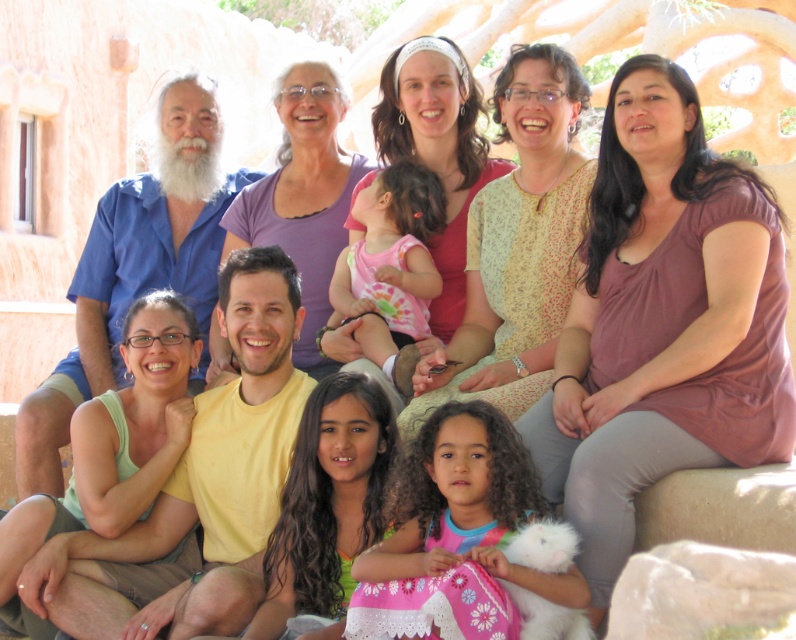
Question: Among these points, which one is nearest to the camera?

Choices:
 (A) (514, 136)
 (B) (408, 531)

Answer: (B)

Question: Can you confirm if green fabric shirt at center is positioned to the left of pink fabric at center?

Choices:
 (A) no
 (B) yes

Answer: (B)

Question: Among these objects, which one is farthest from the camera?

Choices:
 (A) purple satin blouse at center
 (B) yellow floral blouse at center
 (C) pink fabric at center

Answer: (C)

Question: Which point is closer to the camera?

Choices:
 (A) curly-haired girl at center
 (B) purple cotton shirt at upper center
 (C) yellow floral blouse at center
 (D) pink tie-dye shirt at center

Answer: (A)

Question: Can you confirm if purple satin blouse at center is wider than pink fabric at center?

Choices:
 (A) yes
 (B) no

Answer: (A)

Question: Is purple satin blouse at center further to camera compared to curly-haired girl at center?

Choices:
 (A) yes
 (B) no

Answer: (A)